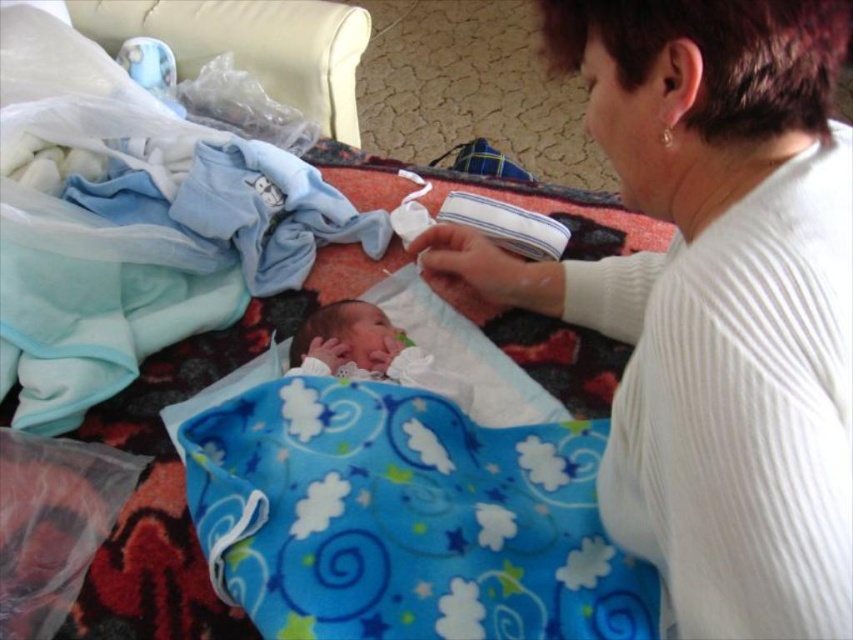
Does blue fleece blanket at center have a larger size compared to soft white swaddling blanket at center?

Yes, blue fleece blanket at center is bigger than soft white swaddling blanket at center.

Is blue fleece blanket at center positioned at the back of soft white swaddling blanket at center?

That is False.

This screenshot has height=640, width=853. Identify the location of blue fleece blanket at center. (405, 518).

Can you confirm if white ribbed sweater at upper right is bigger than blue fleece blanket at center?

Correct, white ribbed sweater at upper right is larger in size than blue fleece blanket at center.

Can you confirm if white ribbed sweater at upper right is positioned below blue fleece blanket at center?

Incorrect, white ribbed sweater at upper right is not positioned below blue fleece blanket at center.

Describe the element at coordinates (712, 300) in the screenshot. I see `white ribbed sweater at upper right` at that location.

Image resolution: width=853 pixels, height=640 pixels. I want to click on white ribbed sweater at upper right, so click(x=712, y=300).

Looking at this image, can you confirm if soft white swaddling blanket at center is smaller than soft white newborn at center?

Incorrect, soft white swaddling blanket at center is not smaller in size than soft white newborn at center.

Can you confirm if soft white swaddling blanket at center is positioned below soft white newborn at center?

Yes, soft white swaddling blanket at center is below soft white newborn at center.

Does point (445, 392) lie in front of point (314, 316)?

Yes.

This screenshot has width=853, height=640. Find the location of `soft white swaddling blanket at center`. soft white swaddling blanket at center is located at coordinates (367, 349).